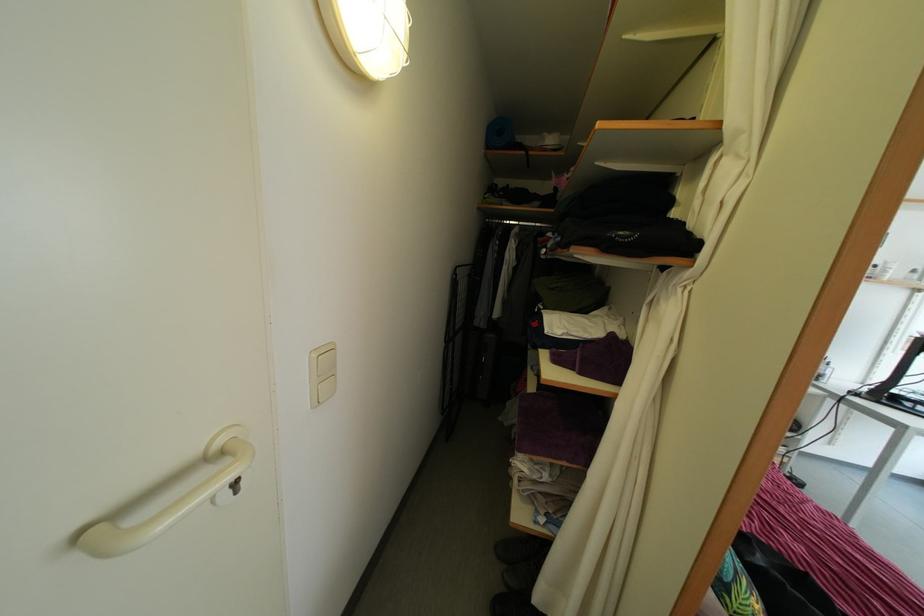
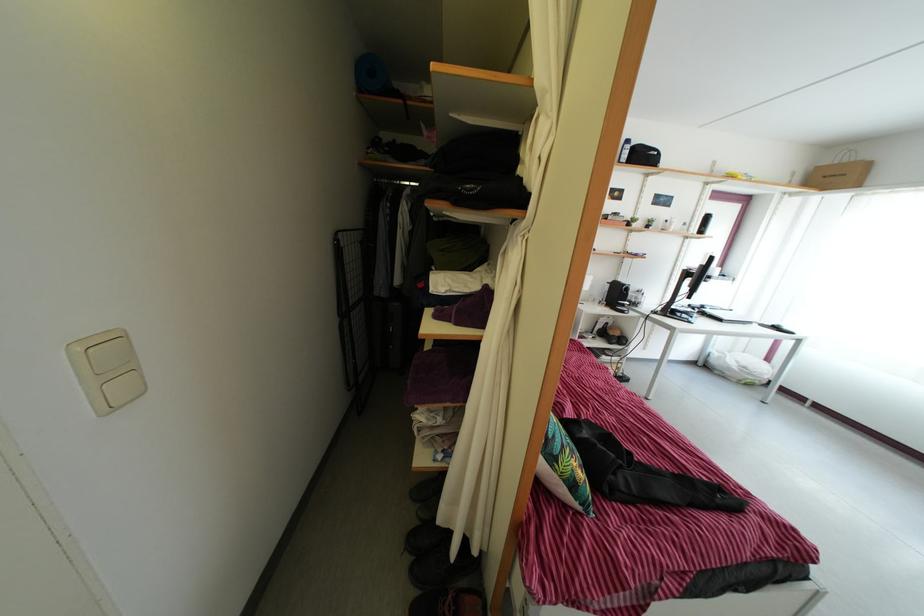
Question: What movement of the cameraman would produce the second image?

Choices:
 (A) Left
 (B) Right
 (C) Forward
 (D) Backward

Answer: (B)